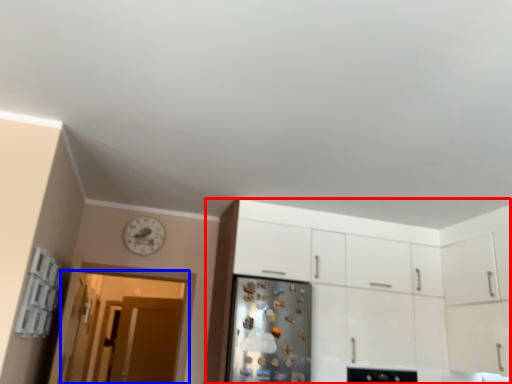
Question: Among these objects, which one is farthest to the camera, cabinetry (highlighted by a red box) or glass door (highlighted by a blue box)?

Choices:
 (A) cabinetry
 (B) glass door

Answer: (B)